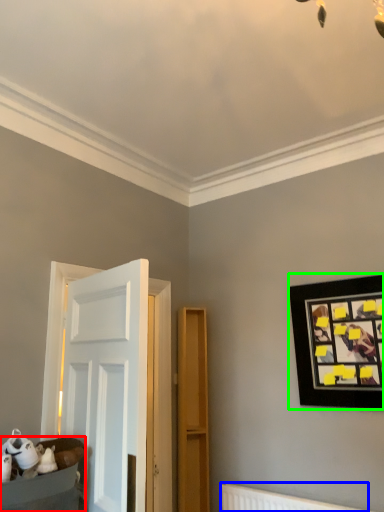
Question: Based on their relative distances, which object is nearer to furniture (highlighted by a red box)? Choose from radiator (highlighted by a blue box) and picture frame (highlighted by a green box).

Choices:
 (A) radiator
 (B) picture frame

Answer: (A)